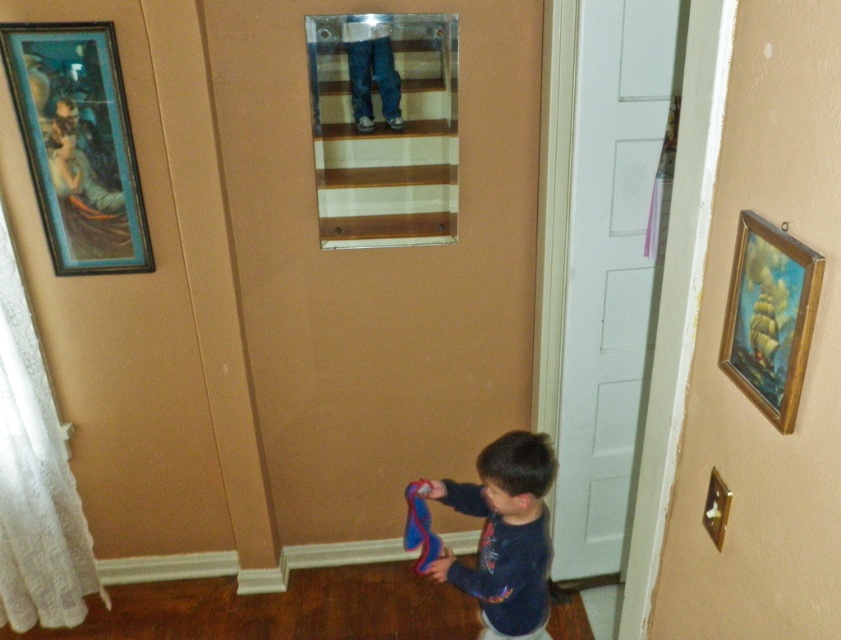
Between dark blue sweater at lower right and gold wooden picture frame at right, which one has more height?

dark blue sweater at lower right

What do you see at coordinates (505, 534) in the screenshot? I see `dark blue sweater at lower right` at bounding box center [505, 534].

Which is behind, point (527, 499) or point (786, 396)?

The point (527, 499) is behind.

Find the location of a particular element. dark blue sweater at lower right is located at coordinates (505, 534).

Does matte black painting at upper left have a smaller size compared to gold wooden picture frame at right?

No, matte black painting at upper left is not smaller than gold wooden picture frame at right.

Is point (51, 84) closer to viewer compared to point (763, 376)?

That is False.

Which is in front, point (34, 109) or point (750, 362)?

Positioned in front is point (750, 362).

Image resolution: width=841 pixels, height=640 pixels. In order to click on matte black painting at upper left in this screenshot , I will do `click(78, 145)`.

Describe the element at coordinates (78, 145) in the screenshot. I see `matte black painting at upper left` at that location.

Is point (104, 26) positioned after point (434, 481)?

That is False.

The width and height of the screenshot is (841, 640). In order to click on matte black painting at upper left in this screenshot , I will do `click(78, 145)`.